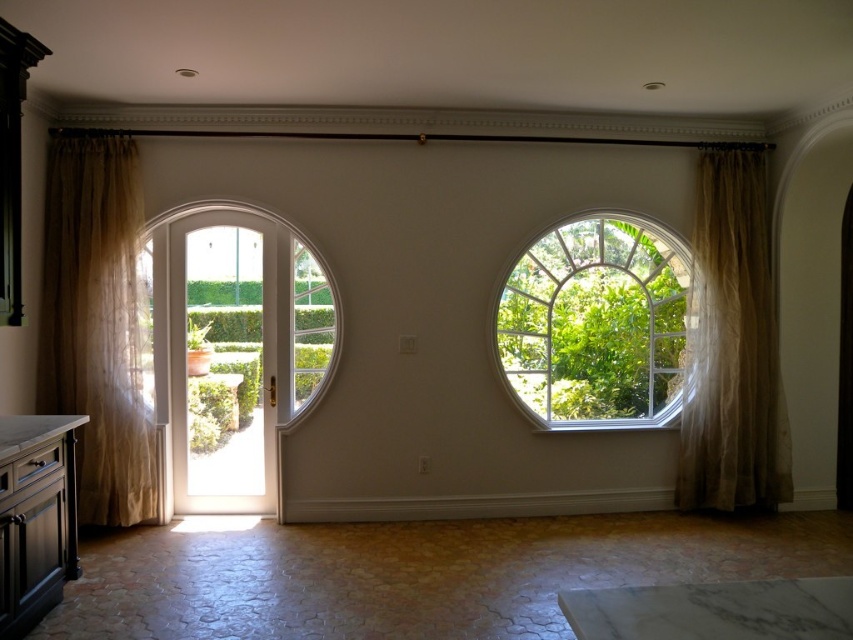
You are an interior designer planning to place a 1.5 meter wide sofa in the living room. The sofa must be positioned between the sheer beige curtain at left and the clear glass window at center. Can the sofa fit in the space between them?

The sheer beige curtain at left has a lesser width compared to clear glass window at center, so the space between them is wider than the curtain. Since the sofa is 1.5 meters wide, it can fit as long as the available space is at least 1.5 meters. However, the exact width isn

You are standing in the room and want to open the sheer beige curtain at right to let more light in. Based on its position, is the curtain on the same wall as the French door?

The sheer beige curtain at right is located at point (730, 346), which is on the same wall as the French door since both are part of the wall with the arched window and French door.